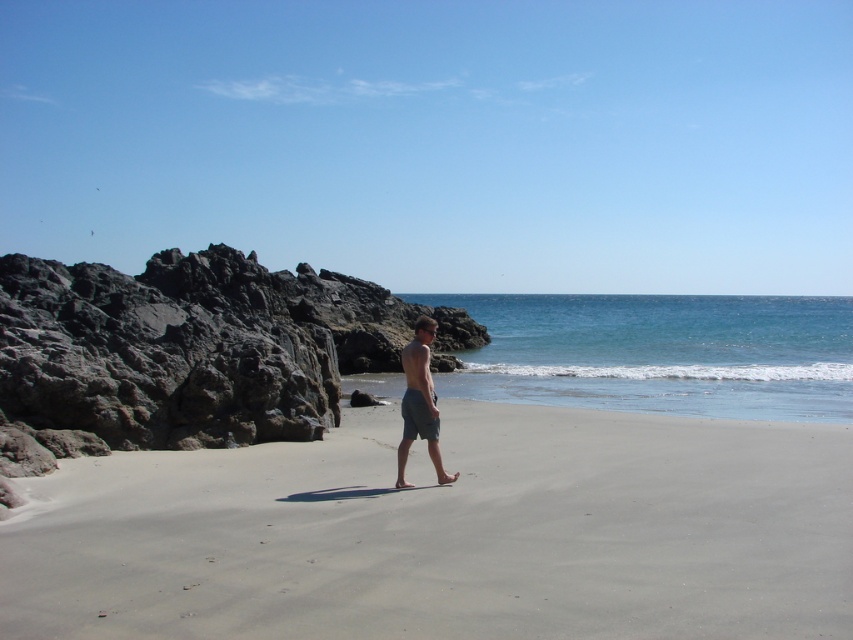
Question: Is gray sand at center bigger than gray cotton shorts at center?

Choices:
 (A) no
 (B) yes

Answer: (B)

Question: Does gray sand at center appear over gray cotton shorts at center?

Choices:
 (A) no
 (B) yes

Answer: (A)

Question: Which of the following is the closest to the observer?

Choices:
 (A) gray sand at center
 (B) gray cotton shorts at center

Answer: (A)

Question: Is gray sand at center above gray cotton shorts at center?

Choices:
 (A) yes
 (B) no

Answer: (B)

Question: Which point appears closest to the camera in this image?

Choices:
 (A) (428, 412)
 (B) (99, 518)

Answer: (B)